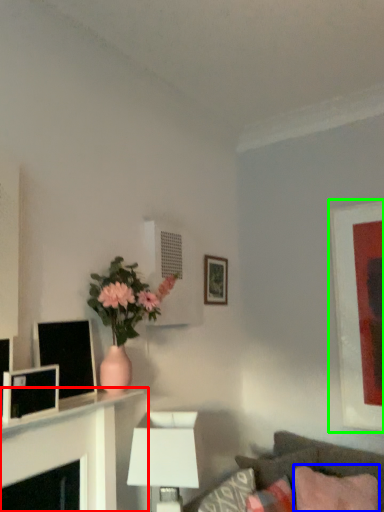
Question: Which object is the closest to the table (highlighted by a red box)? Choose among these: pillow (highlighted by a blue box) or picture frame (highlighted by a green box).

Choices:
 (A) pillow
 (B) picture frame

Answer: (A)